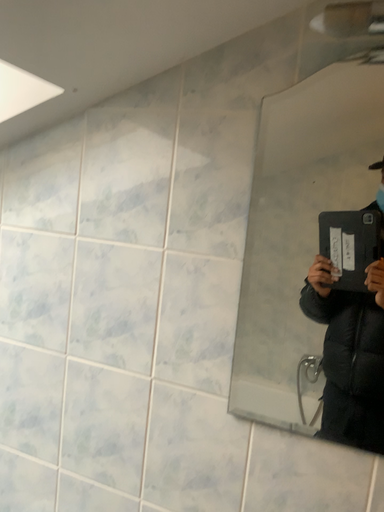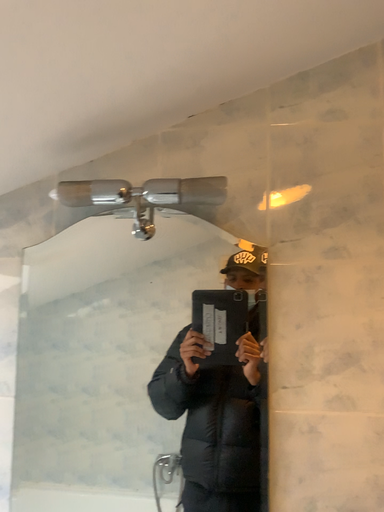
Question: Which way did the camera rotate in the video?

Choices:
 (A) rotated upward
 (B) rotated downward

Answer: (A)